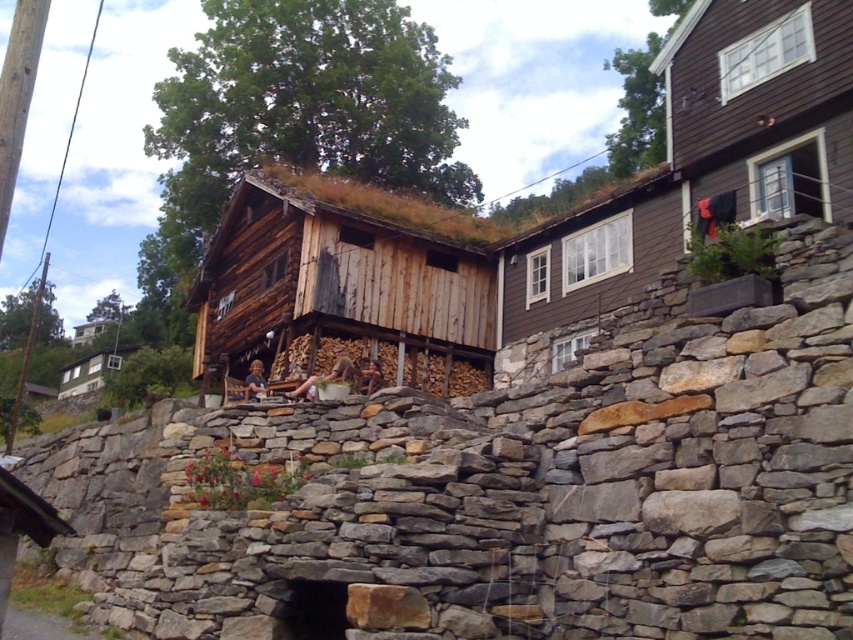
From the picture: You are standing at the entrance of the rustic wooden structure and want to place a decorative statue exactly at the center of the gray stone wall at center. According to the coordinates provided, where should you place the statue?

The gray stone wall at center is located at point (508, 492), so you should place the decorative statue exactly at those coordinates to center it.

You are standing in front of the rustic wooden structure with a grass covered roof. You want to place a small statue exactly at the center of the gray stone wall at center. What are the coordinates where you should place it?

The coordinates for the center of the gray stone wall at center are point (508, 492).

You are planning to set up a picnic area between the weathered wood hut at center and the wooden cabin at lower left. Given that your picnic blanket is 3 meters wide, will it fit comfortably between them without overlapping either structure?

The weathered wood hut at center is wider than the wooden cabin at lower left. However, the exact distance between them isn not provided in the scene description. Therefore, it is uncertain whether the 3 meter picnic blanket will fit comfortably between them.